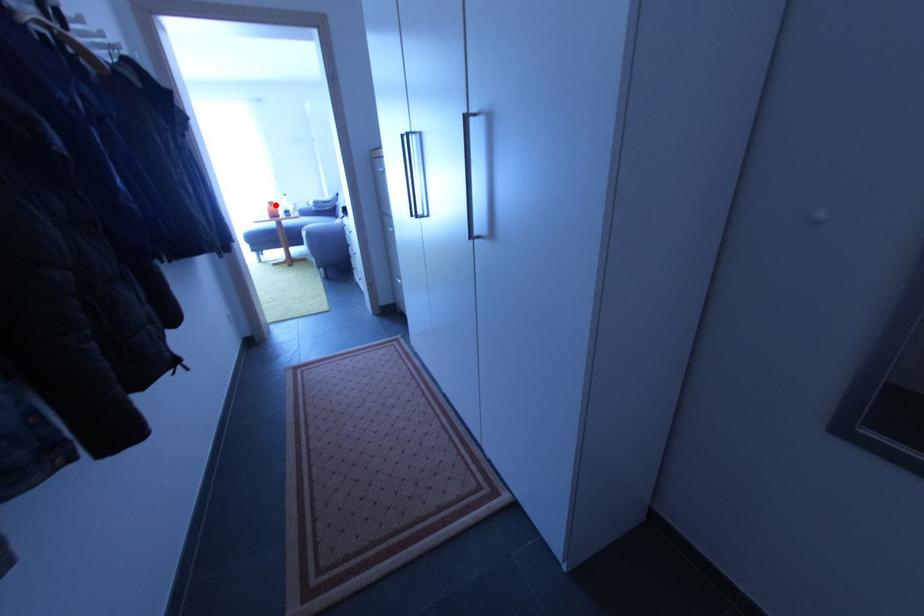
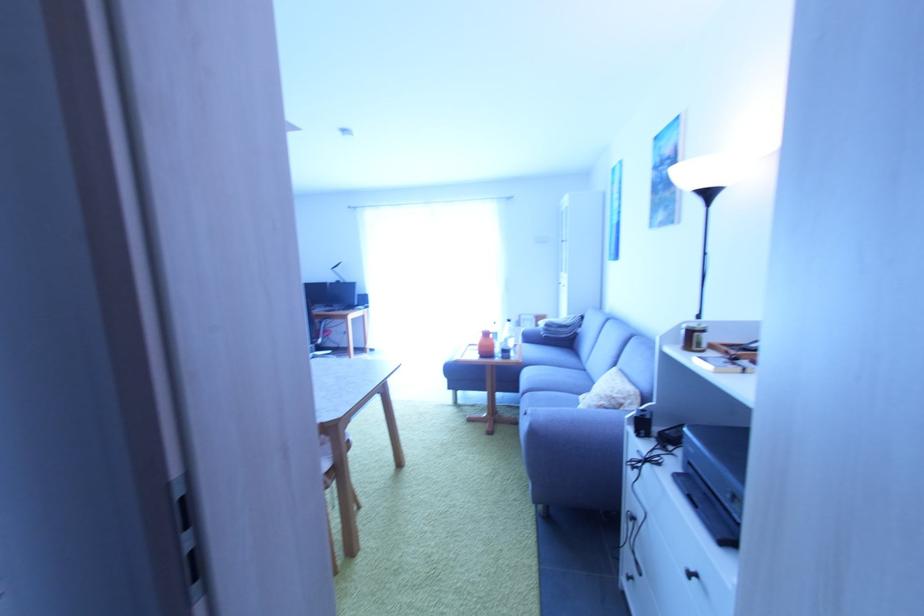
Question: I am providing you with two images of the same scene from different viewpoints. Given a red point in image1, look at the same physical point in image2. Is it:

Choices:
 (A) Closer to the viewpoint
 (B) Farther from the viewpoint

Answer: (B)